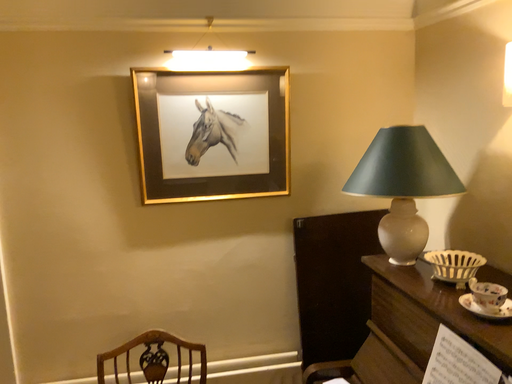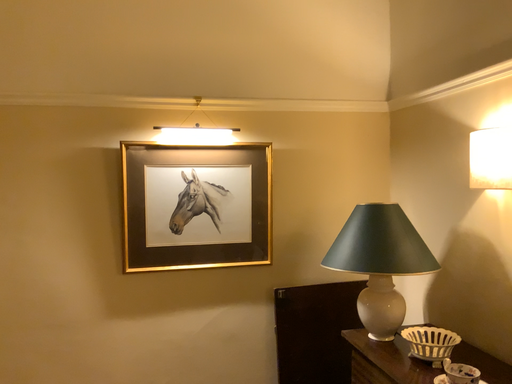
Question: Which way did the camera rotate in the video?

Choices:
 (A) rotated upward
 (B) rotated downward

Answer: (A)